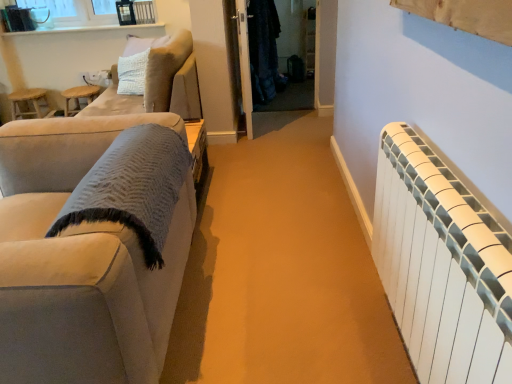
Locate an element on the screen. The height and width of the screenshot is (384, 512). wooden stool at left is located at coordinates (28, 102).

What is the approximate height of suede-like beige couch at upper left, the 1th studio couch when ordered from top to bottom?

suede-like beige couch at upper left, the 1th studio couch when ordered from top to bottom, is 24.74 inches tall.

The width and height of the screenshot is (512, 384). What do you see at coordinates (55, 151) in the screenshot? I see `suede beige armchair at upper left` at bounding box center [55, 151].

Describe the element at coordinates (80, 263) in the screenshot. The image size is (512, 384). I see `suede-like beige couch at left, which is the second studio couch in back-to-front order` at that location.

Locate an element on the screen. Image resolution: width=512 pixels, height=384 pixels. white glossy window sill at upper left is located at coordinates (87, 29).

Where is `wooden stool at left`? This screenshot has height=384, width=512. wooden stool at left is located at coordinates (79, 96).

This screenshot has height=384, width=512. Describe the element at coordinates (79, 96) in the screenshot. I see `wooden stool at left` at that location.

Where is `white glossy door at center`? white glossy door at center is located at coordinates (244, 64).

You are a GUI agent. You are given a task and a screenshot of the screen. Output one action in this format:
    pyautogui.click(x=<x>, y=<y>)
    Task: Click on the wooden stool at left
    This screenshot has width=512, height=384.
    Given the screenshot: What is the action you would take?
    pyautogui.click(x=28, y=102)

From a real-world perspective, which is physically below, suede beige armchair at upper left or white glossy door at center?

From a 3D spatial view, suede beige armchair at upper left is below.

Considering the positions of objects suede beige armchair at upper left and white glossy door at center in the image provided, who is behind, suede beige armchair at upper left or white glossy door at center?

white glossy door at center.

How different are the orientations of suede beige armchair at upper left and white glossy door at center in degrees?

172 degrees separate the facing orientations of suede beige armchair at upper left and white glossy door at center.

From the image's perspective, would you say suede beige armchair at upper left is positioned over white glossy door at center?

No, from the image's perspective, suede beige armchair at upper left is not above white glossy door at center.

Based on the photo, from a real-world perspective, is suede beige armchair at upper left above or below suede-like beige couch at upper left, which ranks as the 2th studio couch in bottom-to-top order?

suede beige armchair at upper left is below suede-like beige couch at upper left, which ranks as the 2th studio couch in bottom-to-top order.

Is the surface of suede beige armchair at upper left in direct contact with suede-like beige couch at upper left, the 1th studio couch when ordered from top to bottom?

No, suede beige armchair at upper left is not in contact with suede-like beige couch at upper left, the 1th studio couch when ordered from top to bottom.

Locate an element on the screen. This screenshot has height=384, width=512. studio couch that appears above the suede beige armchair at upper left (from the image's perspective) is located at coordinates (155, 81).

What's the angular difference between suede beige armchair at upper left and suede-like beige couch at upper left, the 1th studio couch when ordered from top to bottom,'s facing directions?

They differ by 169 degrees in their facing directions.

Which object is closer to the camera taking this photo, white plastic radiator at right or dark matte coat at center?

white plastic radiator at right is in front.

From the image's perspective, between white plastic radiator at right and dark matte coat at center, who is located below?

white plastic radiator at right is shown below in the image.

Which is closer to the camera, (479, 311) or (259, 12)?

Clearly, point (479, 311) is closer to the camera than point (259, 12).

Locate an element on the screen. Image resolution: width=512 pixels, height=384 pixels. radiator located on the right of suede-like beige couch at upper left, the second studio couch when ordered from front to back is located at coordinates (441, 265).

Which is in front, point (146, 110) or point (482, 344)?

The point (482, 344) is closer to the camera.

From the picture: Is suede-like beige couch at upper left, the 1th studio couch viewed from the back, wider than white plastic radiator at right?

Yes, suede-like beige couch at upper left, the 1th studio couch viewed from the back, is wider than white plastic radiator at right.

Is suede-like beige couch at upper left, the 1th studio couch viewed from the back, directly adjacent to white plastic radiator at right?

No, suede-like beige couch at upper left, the 1th studio couch viewed from the back, is not next to white plastic radiator at right.

Is white plastic radiator at right next to white glossy door at center?

No, white plastic radiator at right is not making contact with white glossy door at center.

Is white plastic radiator at right taller than white glossy door at center?

In fact, white plastic radiator at right may be shorter than white glossy door at center.

Is white plastic radiator at right facing towards white glossy door at center?

No, white plastic radiator at right is not facing towards white glossy door at center.

Which object is further away from the camera, white plastic radiator at right or white glossy door at center?

white glossy door at center.

From a real-world perspective, which is physically below, white plastic radiator at right or wooden stool at left?

wooden stool at left.

Are white plastic radiator at right and wooden stool at left located far from each other?

white plastic radiator at right is positioned a significant distance from wooden stool at left.

Would you say white plastic radiator at right contains wooden stool at left?

Definitely not — wooden stool at left is not inside white plastic radiator at right.

Find the location of a particular element. studio couch that appears above the wooden stool at left (from the image's perspective) is located at coordinates (155, 81).

From the picture: Is wooden stool at left in front of or behind suede-like beige couch at upper left, the 1th studio couch when ordered from top to bottom, in the image?

In the image, wooden stool at left appears behind suede-like beige couch at upper left, the 1th studio couch when ordered from top to bottom.

Can you confirm if wooden stool at left is wider than suede-like beige couch at upper left, the 1th studio couch when ordered from top to bottom?

Incorrect, the width of wooden stool at left does not surpass that of suede-like beige couch at upper left, the 1th studio couch when ordered from top to bottom.

Is point (88, 102) positioned behind point (125, 106)?

Yes, point (88, 102) is behind point (125, 106).

Locate an element on the screen. The width and height of the screenshot is (512, 384). door to the right of suede beige armchair at upper left is located at coordinates (244, 64).

Locate an element on the screen. The height and width of the screenshot is (384, 512). studio couch lying above the suede beige armchair at upper left (from the image's perspective) is located at coordinates (155, 81).

Based on their spatial positions, is suede beige armchair at upper left or wooden stool at left further from suede-like beige couch at left, positioned as the 1th studio couch in front-to-back order?

wooden stool at left lies further to suede-like beige couch at left, positioned as the 1th studio couch in front-to-back order, than the other object.

Based on their spatial positions, is suede beige armchair at upper left or white glossy window sill at upper left closer to white plastic radiator at right?

suede beige armchair at upper left lies closer to white plastic radiator at right than the other object.

Considering their positions, is wooden stool at left positioned further to white plastic radiator at right than suede beige armchair at upper left?

Based on the image, wooden stool at left appears to be further to white plastic radiator at right.

Considering their positions, is suede-like beige couch at upper left, the second studio couch when ordered from front to back, positioned closer to white plastic radiator at right than wooden stool at left?

Among the two, suede-like beige couch at upper left, the second studio couch when ordered from front to back, is located nearer to white plastic radiator at right.

Based on their spatial positions, is dark matte coat at center or wooden stool at left further from suede beige armchair at upper left?

dark matte coat at center is positioned further to the anchor suede beige armchair at upper left.

From the image, which object appears to be nearer to white glossy window sill at upper left, dark matte coat at center or wooden stool at left?

The object closer to white glossy window sill at upper left is wooden stool at left.

When comparing their distances from wooden stool at left, does dark matte coat at center or white glossy window sill at upper left seem closer?

white glossy window sill at upper left is closer to wooden stool at left.

Estimate the real-world distances between objects in this image. Which object is closer to suede beige armchair at upper left, dark matte coat at center or white glossy window sill at upper left?

Based on the image, white glossy window sill at upper left appears to be nearer to suede beige armchair at upper left.

Image resolution: width=512 pixels, height=384 pixels. What are the coordinates of `armchair between suede-like beige couch at left, positioned as the 1th studio couch in front-to-back order, and wooden stool at left from front to back` in the screenshot? It's located at (55, 151).

I want to click on studio couch between suede beige armchair at upper left and white glossy window sill at upper left from front to back, so 155,81.

At what (x,y) coordinates should I click in order to perform the action: click on armchair situated between wooden stool at left and white glossy door at center from left to right. Please return your answer as a coordinate pair (x, y). Image resolution: width=512 pixels, height=384 pixels. Looking at the image, I should click on (55, 151).

Locate an element on the screen. armchair located between white plastic radiator at right and white glossy door at center in the depth direction is located at coordinates (55, 151).